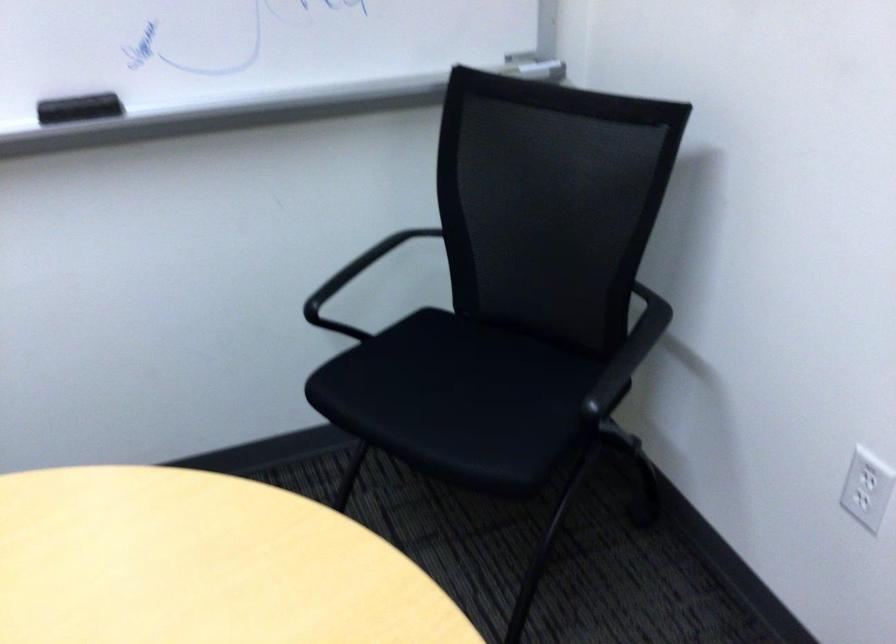
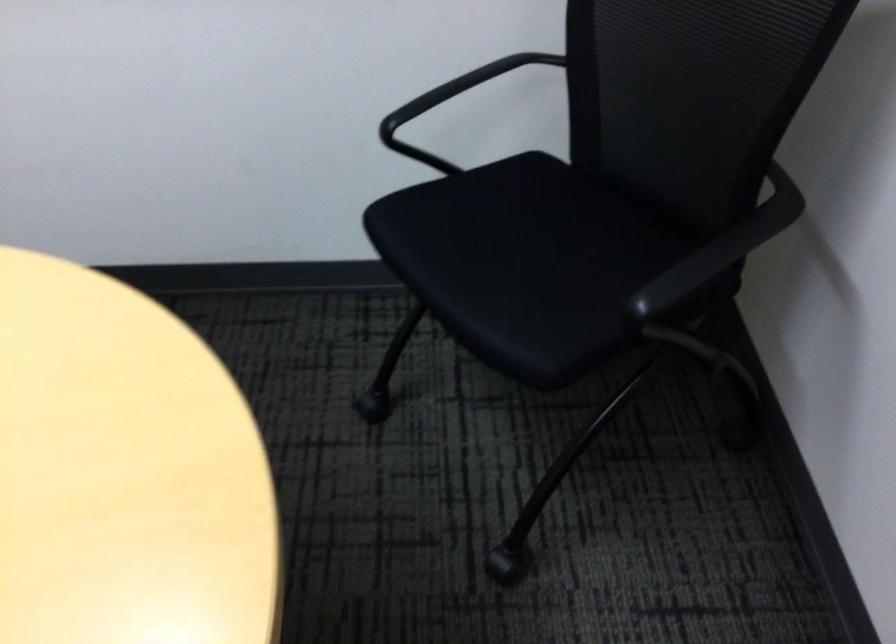
Question: The first image is from the beginning of the video and the second image is from the end. How did the camera likely rotate when shooting the video?

Choices:
 (A) Left
 (B) Right
 (C) Up
 (D) Down

Answer: (A)